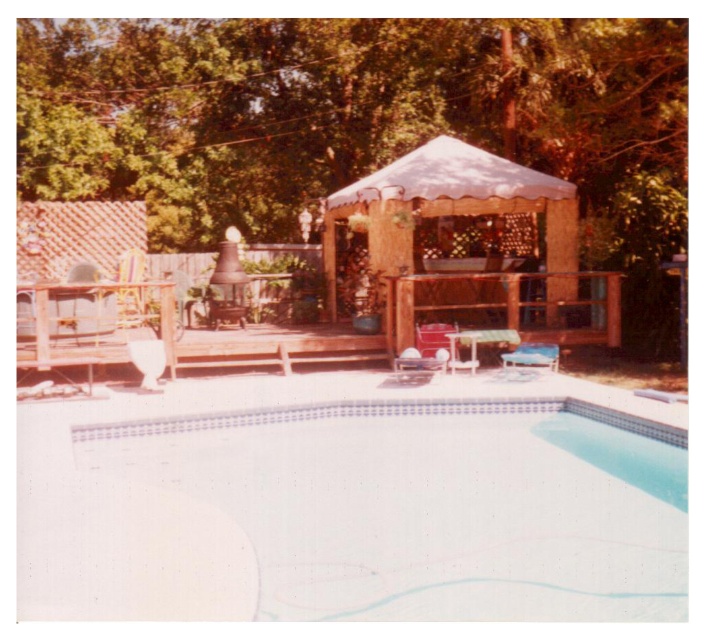
Question: Which object is positioned farthest from the green leafy tree at upper center?

Choices:
 (A) wooden chair at lower right
 (B) white smooth pool at lower center

Answer: (B)

Question: Considering the real-world distances, which object is closest to the white smooth pool at lower center?

Choices:
 (A) wooden gazebo at center
 (B) wooden chair at lower right

Answer: (B)

Question: Which object is the farthest from the white smooth pool at lower center?

Choices:
 (A) wooden chair at lower right
 (B) green leafy tree at upper center

Answer: (B)

Question: Is green leafy tree at upper center below white smooth pool at lower center?

Choices:
 (A) no
 (B) yes

Answer: (A)

Question: Considering the relative positions of wooden gazebo at center and wooden chair at lower right in the image provided, where is wooden gazebo at center located with respect to wooden chair at lower right?

Choices:
 (A) below
 (B) above

Answer: (B)

Question: Considering the relative positions of wooden gazebo at center and wooden chair at lower right in the image provided, where is wooden gazebo at center located with respect to wooden chair at lower right?

Choices:
 (A) right
 (B) left

Answer: (B)